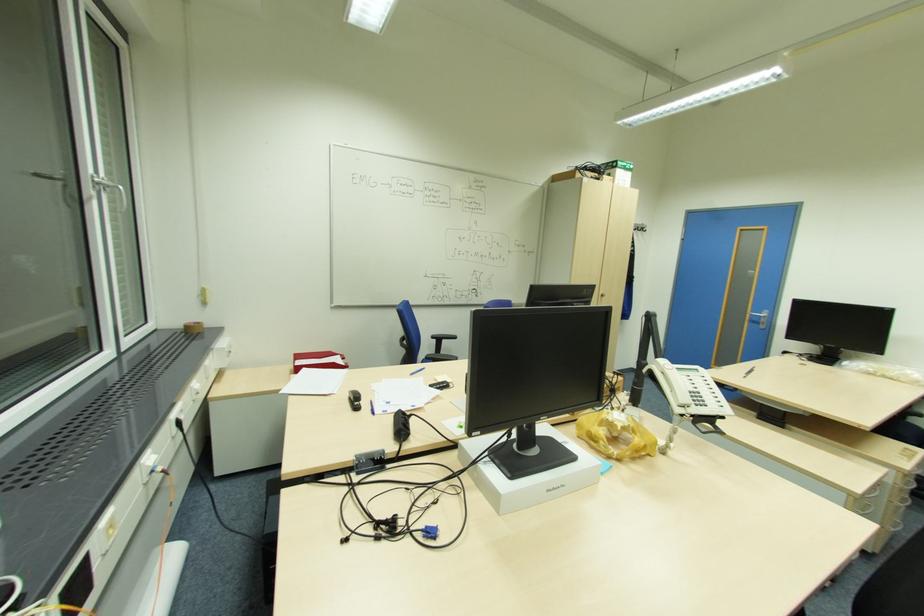
The width and height of the screenshot is (924, 616). Find the location of `white laptop box`. white laptop box is located at coordinates (528, 475).